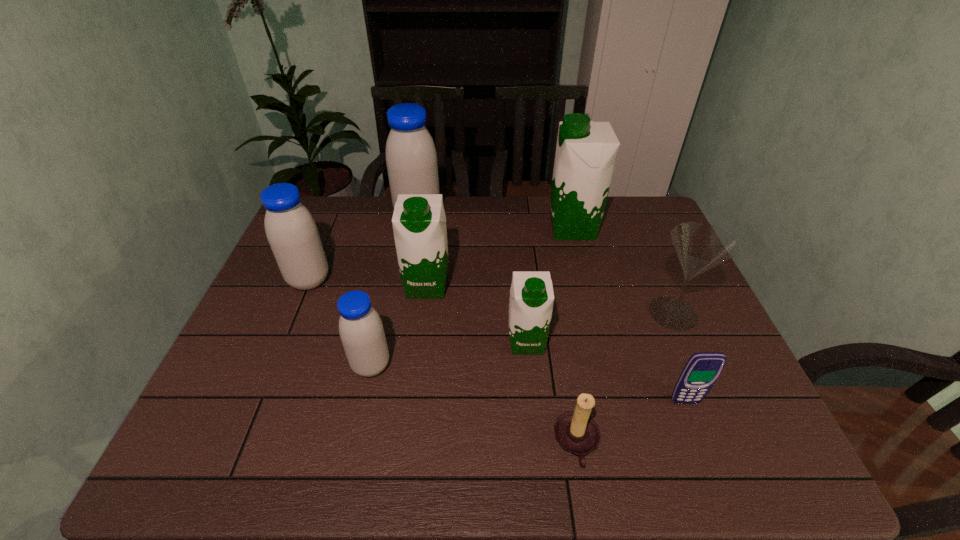
You are a GUI agent. You are given a task and a screenshot of the screen. Output one action in this format:
    pyautogui.click(x=<x>, y=<y>)
    Task: Click on the vacant point located between the brown candle holder and the farthest blue soya milk
    Image resolution: width=960 pixels, height=540 pixels.
    Given the screenshot: What is the action you would take?
    pyautogui.click(x=497, y=331)

Where is `blank region between the biggest blue soya milk and the nearest green soya milk`? Image resolution: width=960 pixels, height=540 pixels. blank region between the biggest blue soya milk and the nearest green soya milk is located at coordinates click(472, 280).

The width and height of the screenshot is (960, 540). What are the coordinates of `free point between the nearest object and the farthest blue soya milk` in the screenshot? It's located at pyautogui.click(x=497, y=331).

I want to click on free point between the nearest blue soya milk and the farthest blue soya milk, so click(x=395, y=292).

Identify the location of free spot between the farthest blue soya milk and the second biggest blue soya milk. This screenshot has width=960, height=540. (364, 249).

The height and width of the screenshot is (540, 960). Identify the location of free spot between the fifth soya milk from left to right and the nearest blue soya milk. (449, 354).

Where is `object that is the second closest one to the nearest blue soya milk`? The height and width of the screenshot is (540, 960). object that is the second closest one to the nearest blue soya milk is located at coordinates (291, 231).

Identify which object is the closest to the rightmost green soya milk. Please provide its 2D coordinates. Your answer should be formatted as a tuple, i.e. [(x, y)], where the tuple contains the x and y coordinates of a point satisfying the conditions above.

[(700, 247)]

Locate an element on the screen. This screenshot has width=960, height=540. soya milk that stands as the fourth closest to the rightmost soya milk is located at coordinates (361, 330).

Select which soya milk is the sixth closest to the cellular telephone. Please provide its 2D coordinates. Your answer should be formatted as a tuple, i.e. [(x, y)], where the tuple contains the x and y coordinates of a point satisfying the conditions above.

[(291, 231)]